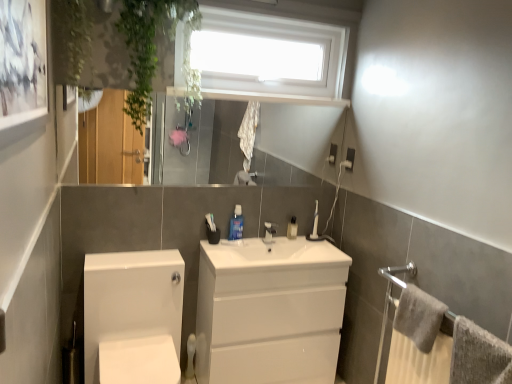
Question: Is white plastic toothbrush at center, which is the second toiletry in front-to-back order, taller or shorter than blue glossy mouthwash at center, which appears as the second toiletry when viewed from the back?

Choices:
 (A) tall
 (B) short

Answer: (B)

Question: From a real-world perspective, relative to blue glossy mouthwash at center, which appears as the second toiletry when viewed from the back, is white plastic toothbrush at center, which ranks as the 1th toiletry in back-to-front order, vertically above or below?

Choices:
 (A) below
 (B) above

Answer: (A)

Question: Which object is the farthest from the white ceramic tap at center?

Choices:
 (A) gray textured towel at lower right, which ranks as the 2th bath towel in front-to-back order
 (B) glossy glass mirror at upper center
 (C) blue glossy mouthwash at center, which appears as the second toiletry when viewed from the back
 (D) white matte toilet paper at lower left
 (E) white glossy porcelain at lower left

Answer: (B)

Question: Which is nearer to the white plastic window at upper center?

Choices:
 (A) gray textured towel at lower right, which ranks as the 2th bath towel in front-to-back order
 (B) white glossy cabinet at center
 (C) white glossy porcelain at lower left
 (D) white plastic toothbrush at center, which ranks as the 1th toiletry in back-to-front order
 (E) white ceramic tap at center

Answer: (D)